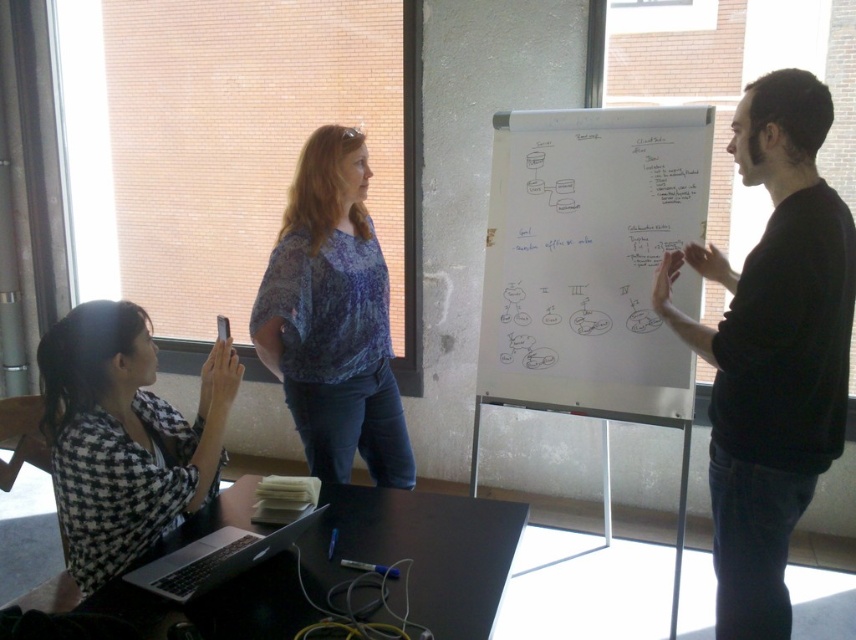
You are organizing a presentation and need to place a name tag on the table. The name tag is the same size as the silver metallic laptop at lower left. Can the black checkered shirt at lower left on the table also fit on the table without overlapping?

The black checkered shirt at lower left is larger in size than the silver metallic laptop at lower left. Since the name tag is the same size as the laptop, the shirt would require more space, so it might not fit without overlapping if placed together.

Based on the coordinates provided, which object is located at point [123,436]?

The black checkered shirt at lower left is located at point [123,436].